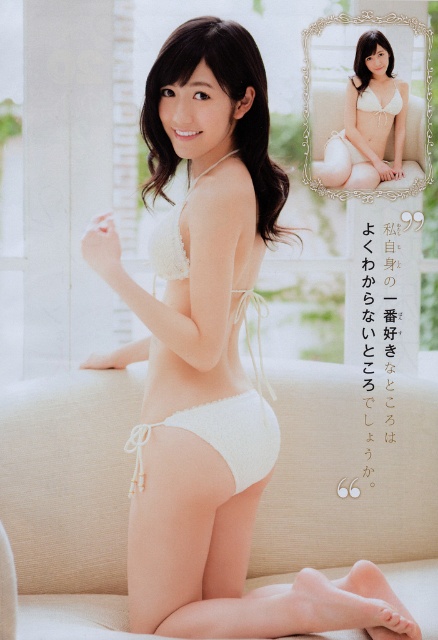
You are standing in the room and see two points marked in the image. Which point is nearer to you, point (254, 420) or point (367, 93)?

Point (254, 420) is closer to the viewer than point (367, 93).

You are a photographer setting up a shoot in the room described. You notice the white crochet bikini at center and the white lace bra at upper right. Which object should you adjust your camera focus to first if you want to capture both items in sharp detail, considering their positions?

The white crochet bikini at center should be focused on first since it is positioned to the left of the white lace bra at upper right, making it closer to the camera. Adjusting focus starting from the closer object ensures both can be in focus when using proper depth of field techniques.